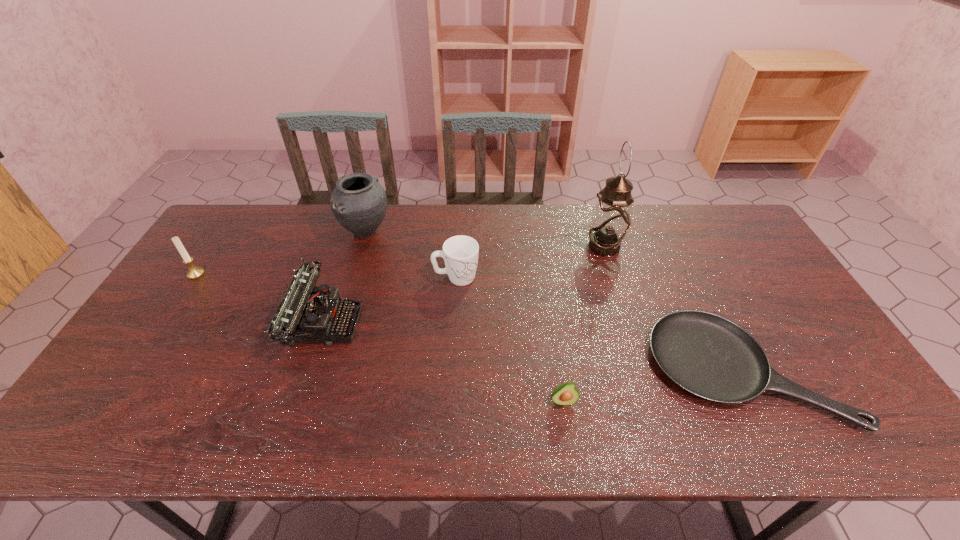
Identify the location of free space between the typewriter and the third object from right to left. (443, 362).

Identify the location of empty space between the shortest object and the fifth shortest object. (470, 322).

The image size is (960, 540). Identify the location of vacant area between the fifth shortest object and the typewriter. (259, 298).

You are a GUI agent. You are given a task and a screenshot of the screen. Output one action in this format:
    pyautogui.click(x=<x>, y=<y>)
    Task: Click on the blank region between the leftmost object and the typewriter
    The image size is (960, 540).
    Given the screenshot: What is the action you would take?
    pyautogui.click(x=259, y=298)

This screenshot has width=960, height=540. Find the location of `free space between the mug and the typewriter`. free space between the mug and the typewriter is located at coordinates coord(390,300).

Image resolution: width=960 pixels, height=540 pixels. What are the coordinates of `free space between the avocado and the mug` in the screenshot? It's located at (510, 339).

Select which object is the third closest to the leftmost object. Please provide its 2D coordinates. Your answer should be formatted as a tuple, i.e. [(x, y)], where the tuple contains the x and y coordinates of a point satisfying the conditions above.

[(460, 253)]

Locate an element on the screen. This screenshot has height=540, width=960. object that is the fifth nearest to the typewriter is located at coordinates (611, 220).

You are a GUI agent. You are given a task and a screenshot of the screen. Output one action in this format:
    pyautogui.click(x=<x>, y=<y>)
    Task: Click on the free space that satisfies the following two spatial constraints: 1. on the back side of the leftmost object; 2. on the left side of the second tallest object
    The image size is (960, 540).
    Given the screenshot: What is the action you would take?
    pyautogui.click(x=225, y=232)

The width and height of the screenshot is (960, 540). I want to click on vacant area in the image that satisfies the following two spatial constraints: 1. on the side of the frying pan with the handle; 2. on the left side of the fourth object from left to right, so [450, 369].